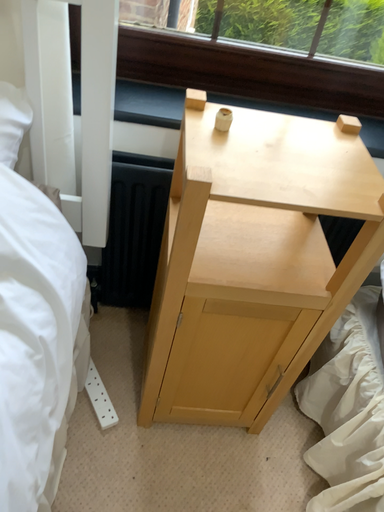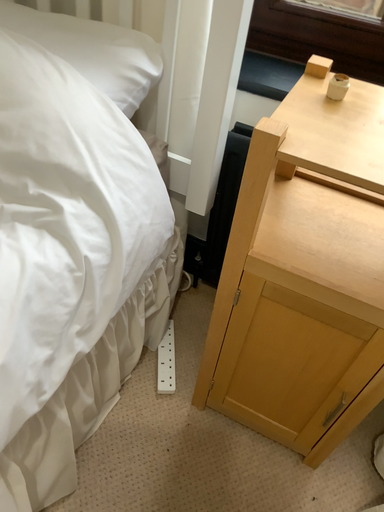
Question: How did the camera likely rotate when shooting the video?

Choices:
 (A) rotated right
 (B) rotated left

Answer: (B)